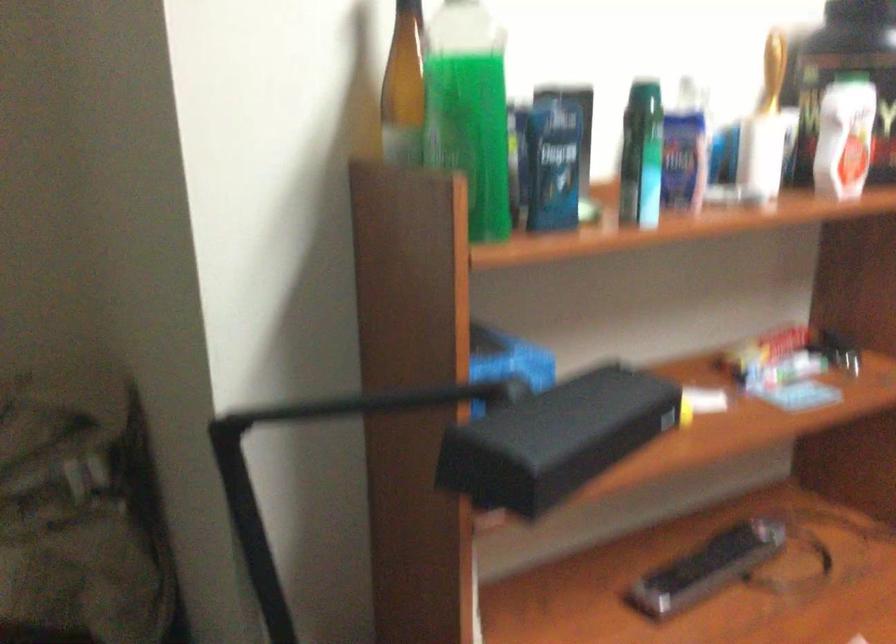
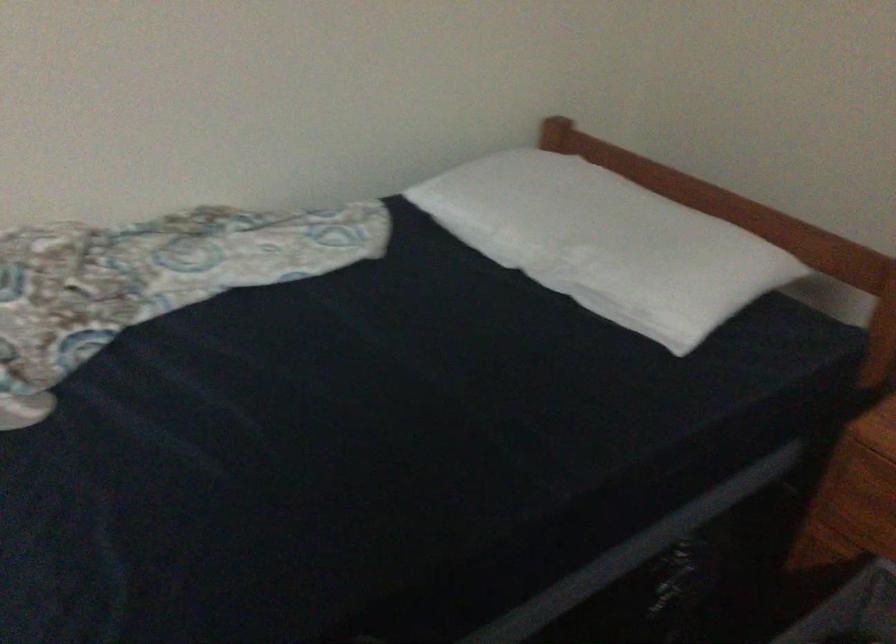
First-person continuous shooting, in which direction is the camera rotating?

The rotation direction of the camera is left-down.